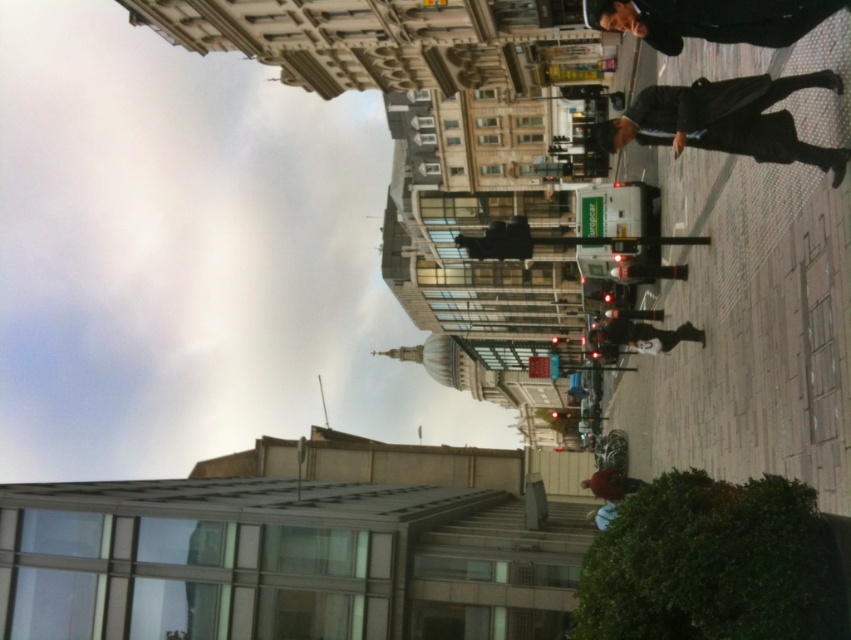
Is dark blue suit at right wider than dark gray jacket at center?

Yes.

Who is more forward, (755,134) or (695,328)?

Positioned in front is point (755,134).

Which is behind, point (665, 138) or point (604, 326)?

Point (604, 326)

At what (x,y) coordinates should I click in order to perform the action: click on dark blue suit at right. Please return your answer as a coordinate pair (x, y). Looking at the image, I should click on (724, 120).